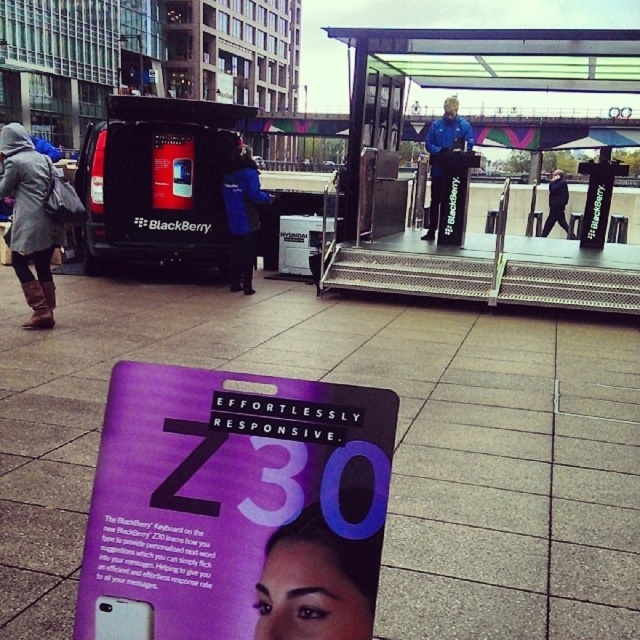
Is smooth purple poster at center to the left of black leather jacket at center from the viewer's perspective?

Correct, you'll find smooth purple poster at center to the left of black leather jacket at center.

Does point (285, 547) lie in front of point (557, 202)?

Yes.

Where is `smooth purple poster at center`? smooth purple poster at center is located at coordinates (314, 584).

The height and width of the screenshot is (640, 640). Identify the location of smooth purple poster at center. (314, 584).

Who is taller, leather boots at lower left or black leather jacket at center?

leather boots at lower left

Is leather boots at lower left positioned in front of black leather jacket at center?

Yes.

Which is in front, point (12, 156) or point (554, 196)?

Positioned in front is point (12, 156).

I want to click on leather boots at lower left, so click(29, 220).

Looking at this image, which is below, blue jacket at center or blue fabric jacket at center?

Positioned lower is blue jacket at center.

Can you confirm if blue jacket at center is shorter than blue fabric jacket at center?

No.

Which is behind, point (244, 227) or point (429, 148)?

The point (429, 148) is more distant.

Locate an element on the screen. blue jacket at center is located at coordinates (243, 216).